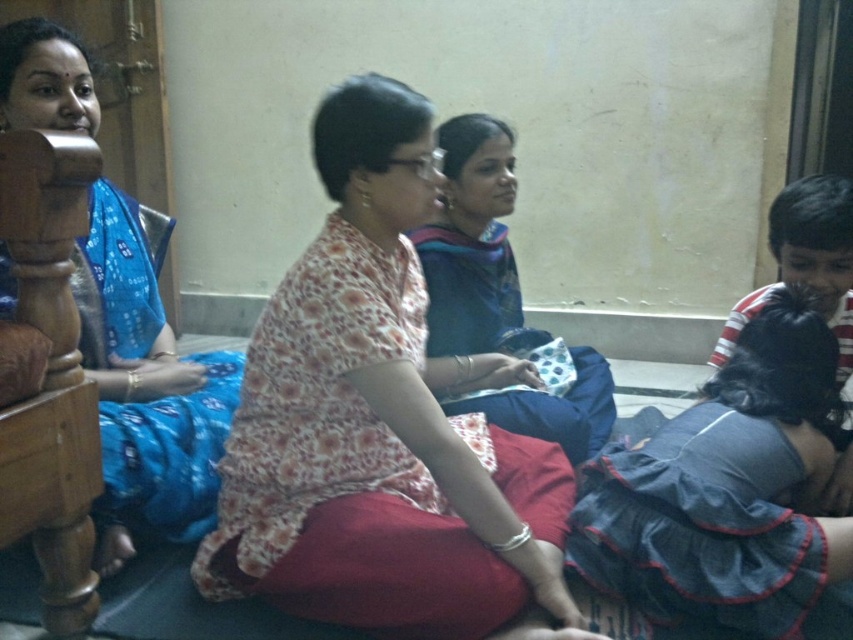
You are organizing a clothing display and need to place the floral fabric blouse at center and the dark blue satin sari at lower right on a rack. Which item requires more horizontal space due to its width?

The floral fabric blouse at center requires more horizontal space because its width is larger than the dark blue satin sari at lower right.

You are organizing a small event and need to place a 12 inch wide decorative item between the floral fabric blouse at center and the blue printed saree at left. Will there be enough space to fit it without overlapping either clothing item?

The distance between the floral fabric blouse at center and the blue printed saree at left is 18.59 inches, which is greater than the 12 inch width of the decorative item. Therefore, there is sufficient space to place the item between them without overlapping.

You are standing in the room and want to reach the point marked at coordinates (328,317). If you are 1.6 meters tall, can you comfortably reach that point without stretching?

The distance between you and the point marked at coordinates (328,317) is 1.39 meters. Since the average comfortable reaching distance for a person of your height is about 1.5 meters, you can comfortably reach it without stretching.